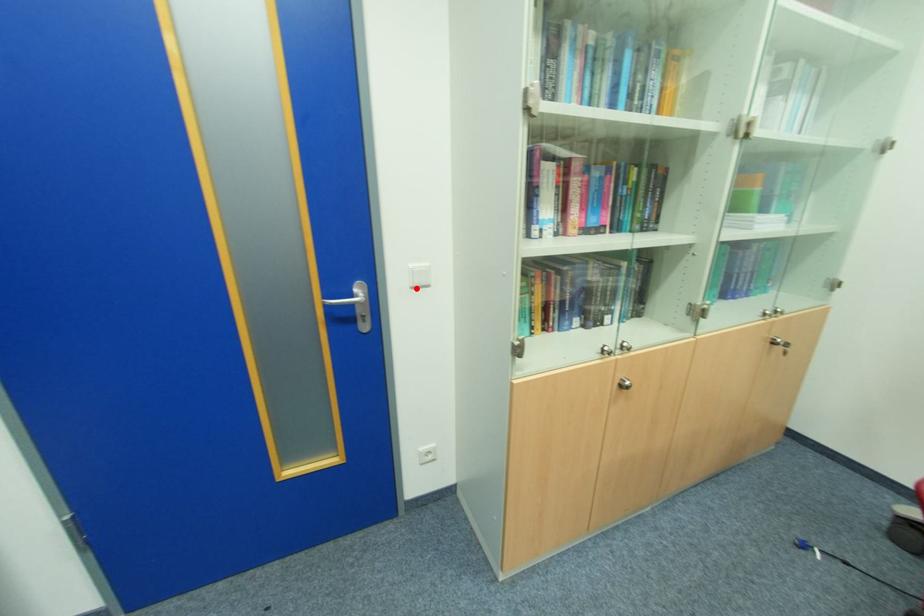
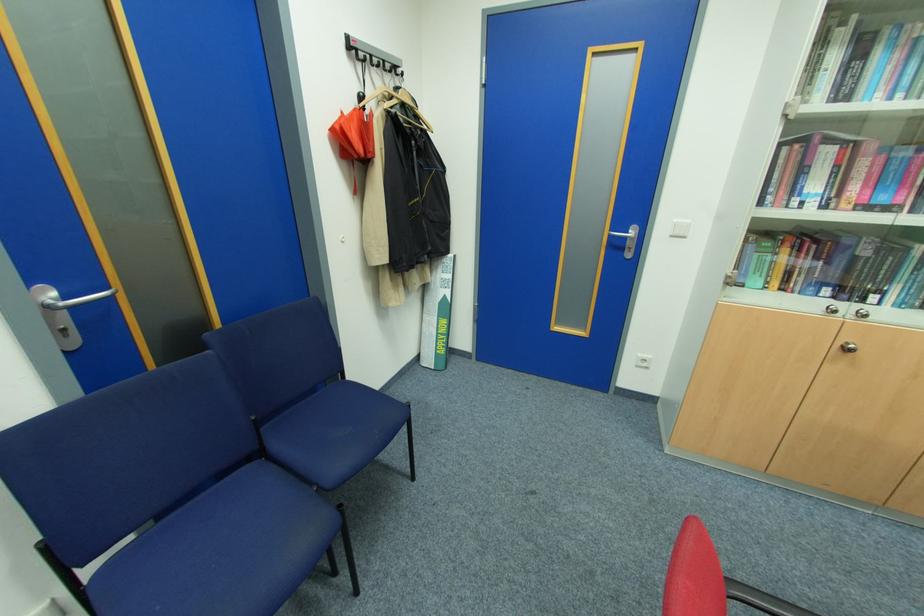
Question: I am providing you with two images of the same scene from different viewpoints. A red point is marked on the first image. At the location where the point appears in image 1, is it still visible in image 2?

Choices:
 (A) Yes
 (B) No

Answer: (A)